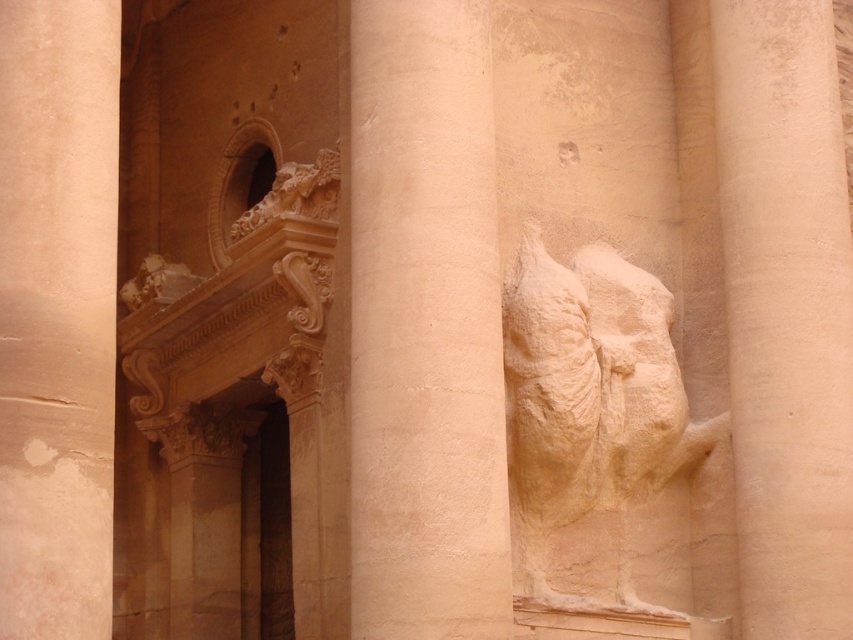
Based on the photo, you are an architect examining the historical stone structure. You notice two points marked on the image. The first point is at coordinate point (431, 42) and the second is at coordinate point (749, 420). Which of these points is nearer to your viewpoint?

Point (431, 42) is closer to the camera than point (749, 420).

You are an architect examining the historical stone structure. You notice two columns, the smooth sandstone column at center and the smooth sandstone column at right. Which column is located below the other?

The smooth sandstone column at center is positioned under the smooth sandstone column at right, meaning it is located below the other.

Based on the photo, you are an architect examining the historical stone structure. You need to determine the spatial arrangement of the columns. Based on the scene, which object is closer to you between the smooth sandstone column at right and the smooth sandstone pillar at center?

The smooth sandstone column at right is closer to you because the smooth sandstone pillar at center is behind it.